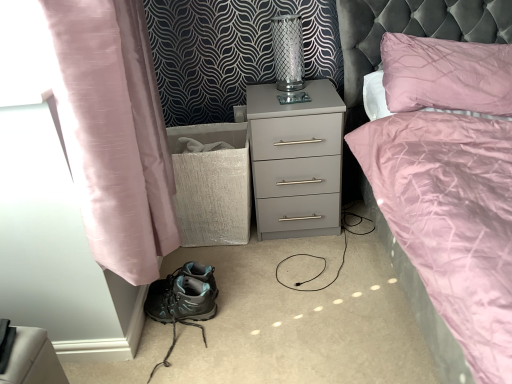
Find the location of a particular element. This screenshot has height=384, width=512. teal fabric hiking boots at lower left is located at coordinates (183, 295).

Consider the image. What is the approximate width of matte gray nightstand at center?

The width of matte gray nightstand at center is 18.05 inches.

Describe the element at coordinates (296, 160) in the screenshot. The width and height of the screenshot is (512, 384). I see `matte gray nightstand at center` at that location.

This screenshot has width=512, height=384. Identify the location of pink silk curtain at left. (114, 132).

Where is `clear glass vase at upper center`? The height and width of the screenshot is (384, 512). clear glass vase at upper center is located at coordinates (288, 58).

How different are the orientations of pink silk curtain at left and teal fabric hiking boots at lower left in degrees?

0.72 degrees separate the facing orientations of pink silk curtain at left and teal fabric hiking boots at lower left.

Are pink silk curtain at left and teal fabric hiking boots at lower left making contact?

No, pink silk curtain at left is not in contact with teal fabric hiking boots at lower left.

From a real-world perspective, is pink silk curtain at left above or below teal fabric hiking boots at lower left?

From a real-world perspective, pink silk curtain at left is physically above teal fabric hiking boots at lower left.

Is teal fabric hiking boots at lower left at the back of pink silk curtain at left?

No, pink silk curtain at left is not facing the opposite direction of teal fabric hiking boots at lower left.

Between teal fabric hiking boots at lower left and matte gray nightstand at center, which one has larger width?

Wider between the two is matte gray nightstand at center.

Considering the relative sizes of teal fabric hiking boots at lower left and matte gray nightstand at center in the image provided, is teal fabric hiking boots at lower left smaller than matte gray nightstand at center?

Correct, teal fabric hiking boots at lower left occupies less space than matte gray nightstand at center.

Can you tell me how much teal fabric hiking boots at lower left and matte gray nightstand at center differ in facing direction?

The angle between the facing direction of teal fabric hiking boots at lower left and the facing direction of matte gray nightstand at center is 90 degrees.

Is matte gray nightstand at center to the left of pink silk curtain at left from the viewer's perspective?

Incorrect, matte gray nightstand at center is not on the left side of pink silk curtain at left.

Does matte gray nightstand at center turn towards pink silk curtain at left?

No, matte gray nightstand at center does not turn towards pink silk curtain at left.

Is matte gray nightstand at center far from pink silk curtain at left?

That's not correct — matte gray nightstand at center is a little close to pink silk curtain at left.

Between point (281, 101) and point (287, 188), which one is positioned in front?

Point (281, 101)

Considering the sizes of clear glass vase at upper center and matte gray nightstand at center in the image, is clear glass vase at upper center wider or thinner than matte gray nightstand at center?

Considering their sizes, clear glass vase at upper center looks slimmer than matte gray nightstand at center.

Is teal fabric hiking boots at lower left to the left of pink silk curtain at left from the viewer's perspective?

No, teal fabric hiking boots at lower left is not to the left of pink silk curtain at left.

Does teal fabric hiking boots at lower left come in front of pink silk curtain at left?

No, the depth of teal fabric hiking boots at lower left is greater than that of pink silk curtain at left.

From a real-world perspective, between teal fabric hiking boots at lower left and pink silk curtain at left, who is vertically higher?

pink silk curtain at left.

From the picture: Does clear glass vase at upper center appear on the right side of pink silk curtain at left?

Yes, clear glass vase at upper center is to the right of pink silk curtain at left.

Would you consider clear glass vase at upper center to be distant from pink silk curtain at left?

clear glass vase at upper center is near pink silk curtain at left, not far away.

Which of these two, clear glass vase at upper center or pink silk curtain at left, is thinner?

Thinner between the two is clear glass vase at upper center.

Measure the distance between clear glass vase at upper center and pink silk curtain at left.

A distance of 30.90 inches exists between clear glass vase at upper center and pink silk curtain at left.

From the image's perspective, between pink silk curtain at left and clear glass vase at upper center, who is located below?

From the image's view, pink silk curtain at left is below.

Is pink silk curtain at left completely or partially outside of clear glass vase at upper center?

Yes, pink silk curtain at left is not within clear glass vase at upper center.

What's the angular difference between pink silk curtain at left and clear glass vase at upper center's facing directions?

The angle between the facing direction of pink silk curtain at left and the facing direction of clear glass vase at upper center is 88.2 degrees.

In the scene shown: Is pink silk curtain at left further to the viewer compared to clear glass vase at upper center?

That is False.

Where is `footwear that is on the right side of pink silk curtain at left`? This screenshot has height=384, width=512. footwear that is on the right side of pink silk curtain at left is located at coordinates (183, 295).

You are a GUI agent. You are given a task and a screenshot of the screen. Output one action in this format:
    pyautogui.click(x=<x>, y=<y>)
    Task: Click on the footwear on the left side of matte gray nightstand at center
    
    Given the screenshot: What is the action you would take?
    pyautogui.click(x=183, y=295)

Based on their spatial positions, is teal fabric hiking boots at lower left or matte gray nightstand at center further from pink silk curtain at left?

matte gray nightstand at center is positioned further to the anchor pink silk curtain at left.

Based on their spatial positions, is teal fabric hiking boots at lower left or clear glass vase at upper center closer to matte gray nightstand at center?

clear glass vase at upper center lies closer to matte gray nightstand at center than the other object.

In the scene shown: When comparing their distances from clear glass vase at upper center, does matte gray nightstand at center or teal fabric hiking boots at lower left seem further?

teal fabric hiking boots at lower left is further to clear glass vase at upper center.

Based on their spatial positions, is pink silk curtain at left or matte gray nightstand at center closer to clear glass vase at upper center?

Based on the image, matte gray nightstand at center appears to be nearer to clear glass vase at upper center.

From the image, which object appears to be nearer to clear glass vase at upper center, teal fabric hiking boots at lower left or pink silk curtain at left?

Based on the image, pink silk curtain at left appears to be nearer to clear glass vase at upper center.

Considering their positions, is matte gray nightstand at center positioned closer to teal fabric hiking boots at lower left than pink silk curtain at left?

Among the two, pink silk curtain at left is located nearer to teal fabric hiking boots at lower left.

Looking at the image, which one is located closer to matte gray nightstand at center, teal fabric hiking boots at lower left or pink silk curtain at left?

Among the two, teal fabric hiking boots at lower left is located nearer to matte gray nightstand at center.

When comparing their distances from pink silk curtain at left, does clear glass vase at upper center or teal fabric hiking boots at lower left seem further?

clear glass vase at upper center.

Identify the location of nightstand between clear glass vase at upper center and teal fabric hiking boots at lower left vertically. This screenshot has height=384, width=512. (296, 160).

This screenshot has width=512, height=384. Find the location of `curtain between clear glass vase at upper center and teal fabric hiking boots at lower left in the up-down direction`. curtain between clear glass vase at upper center and teal fabric hiking boots at lower left in the up-down direction is located at coordinates (114, 132).

This screenshot has height=384, width=512. I want to click on footwear between pink silk curtain at left and matte gray nightstand at center in the front-back direction, so click(x=183, y=295).

Where is `nightstand between pink silk curtain at left and clear glass vase at upper center in the front-back direction`? The width and height of the screenshot is (512, 384). nightstand between pink silk curtain at left and clear glass vase at upper center in the front-back direction is located at coordinates (296, 160).